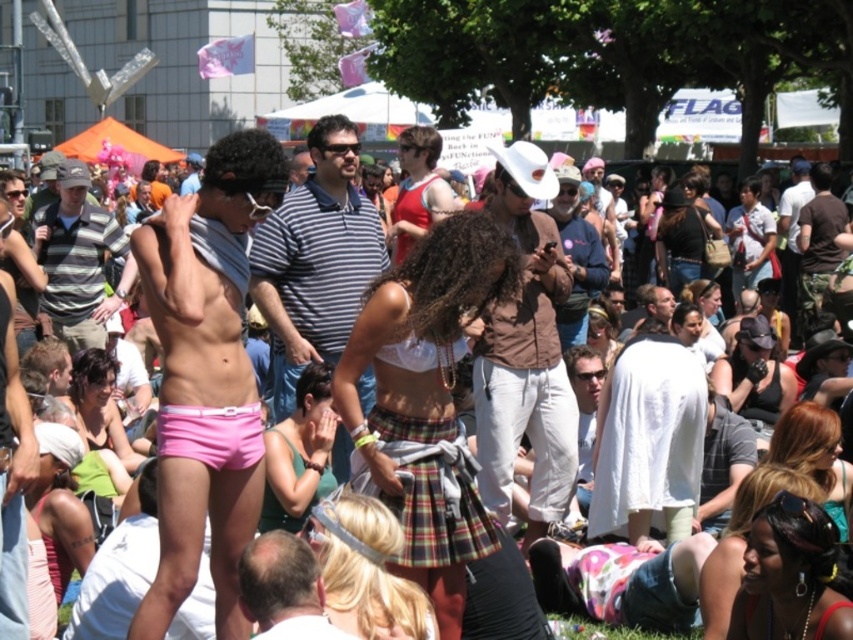
You are standing at the center of the image and see a point marked at coordinates [525,355]. What object is located at that point?

The brown matte jacket at center is located at the point marked by coordinates [525,355].

You are a photographer at the event and want to capture both the white lace bra at center and the matte black shirt at center in the same frame. Which object should you position to the left to ensure both are visible?

The white lace bra at center should be positioned to the left of the matte black shirt at center to ensure both are visible in the frame.

You are at a festival and see two people wearing a brown matte jacket at center and a striped cotton shirt at center. Which clothing item is lower in position?

The brown matte jacket at center is located below the striped cotton shirt at center, so the brown matte jacket at center is lower in position.